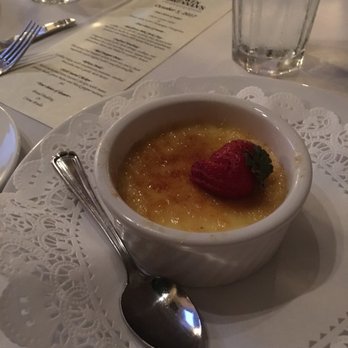
Locate an element on the screen. bottom of glass is located at coordinates (277, 46).